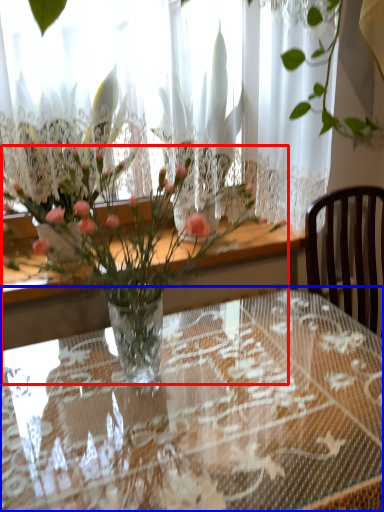
Question: Which point is closer to the camera, bouquet (highlighted by a red box) or table (highlighted by a blue box)?

Choices:
 (A) bouquet
 (B) table

Answer: (B)